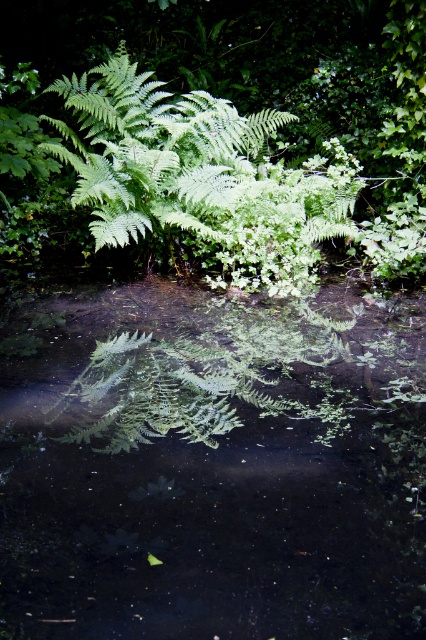
Question: Does green leafy water at center have a greater width compared to green leafy fern at upper center?

Choices:
 (A) yes
 (B) no

Answer: (A)

Question: Which point is closer to the camera?

Choices:
 (A) green leafy fern at upper center
 (B) green leafy water at center

Answer: (B)

Question: Is green leafy water at center to the left of green leafy fern at upper center from the viewer's perspective?

Choices:
 (A) no
 (B) yes

Answer: (B)

Question: Among these objects, which one is farthest from the camera?

Choices:
 (A) green leafy water at center
 (B) green leafy fern at upper center

Answer: (B)

Question: Observing the image, what is the correct spatial positioning of green leafy water at center in reference to green leafy fern at upper center?

Choices:
 (A) above
 (B) below

Answer: (B)